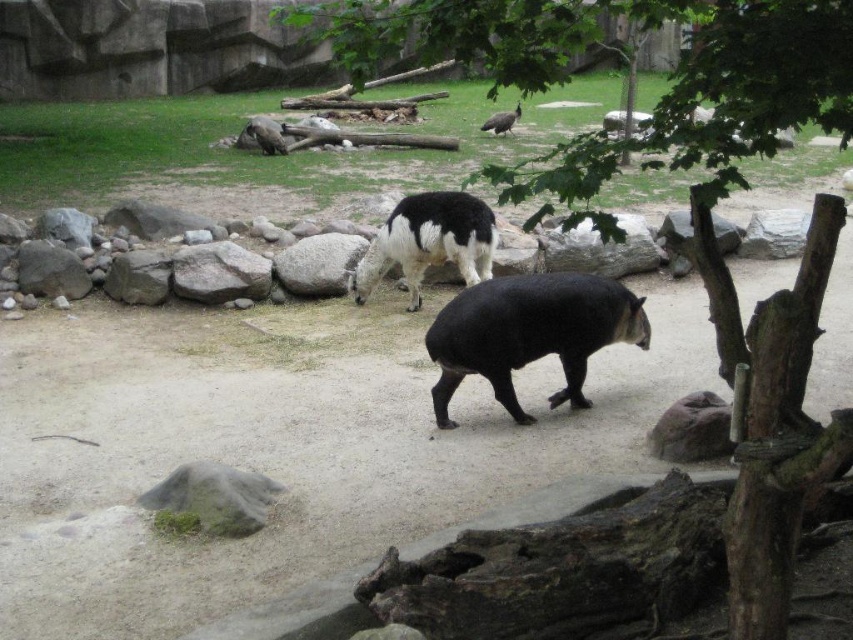
Does black smooth tapir at center have a larger size compared to white woolen llama at center?

Incorrect, black smooth tapir at center is not larger than white woolen llama at center.

What do you see at coordinates (529, 333) in the screenshot? I see `black smooth tapir at center` at bounding box center [529, 333].

Identify the location of black smooth tapir at center. This screenshot has width=853, height=640. (529, 333).

Between green leafy tree at upper center and white woolen llama at upper center, which one appears on the left side from the viewer's perspective?

white woolen llama at upper center

Does point (576, 26) lie in front of point (268, 152)?

Yes, point (576, 26) is closer to viewer.

Does point (380, 38) lie in front of point (260, 129)?

Yes, point (380, 38) is closer to viewer.

Where is `green leafy tree at upper center`? The height and width of the screenshot is (640, 853). green leafy tree at upper center is located at coordinates (660, 93).

Looking at this image, is green leafy tree at upper center to the right of black smooth tapir at center from the viewer's perspective?

Correct, you'll find green leafy tree at upper center to the right of black smooth tapir at center.

Who is more forward, [323,22] or [492,317]?

Point [492,317] is in front.

Measure the distance between green leafy tree at upper center and camera.

green leafy tree at upper center is 8.72 feet from camera.

This screenshot has height=640, width=853. Find the location of `green leafy tree at upper center`. green leafy tree at upper center is located at coordinates (660, 93).